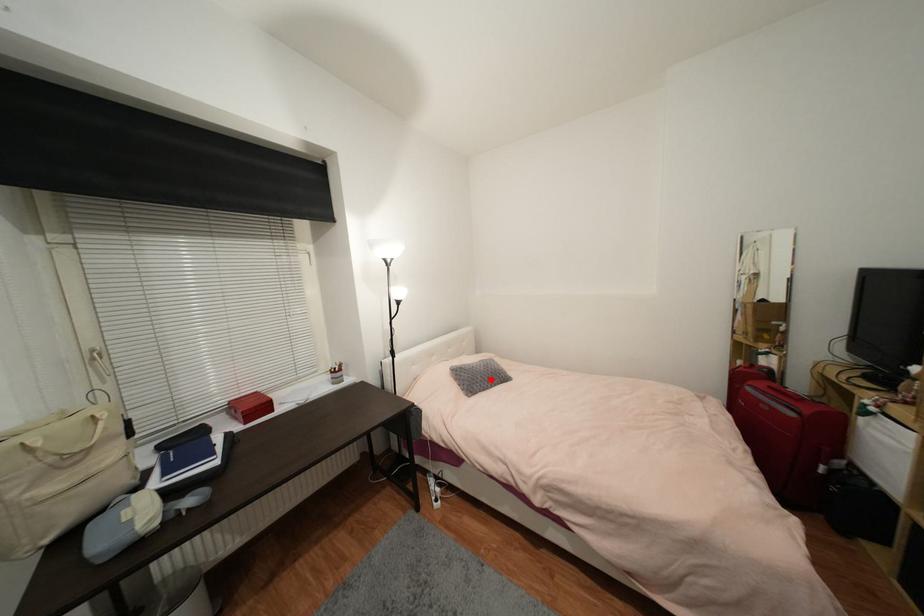
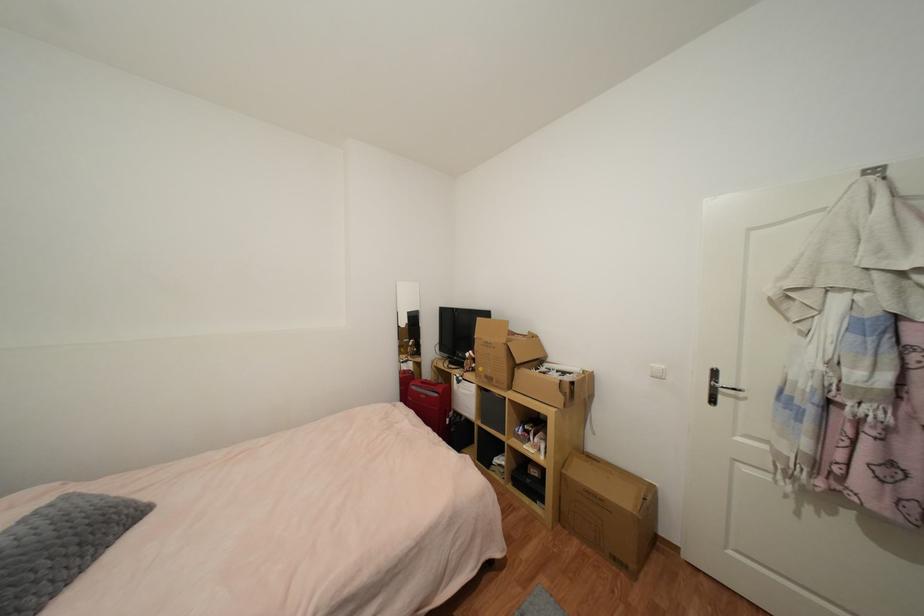
In the second image, find the point that corresponds to the highlighted location in the first image.

(79, 551)